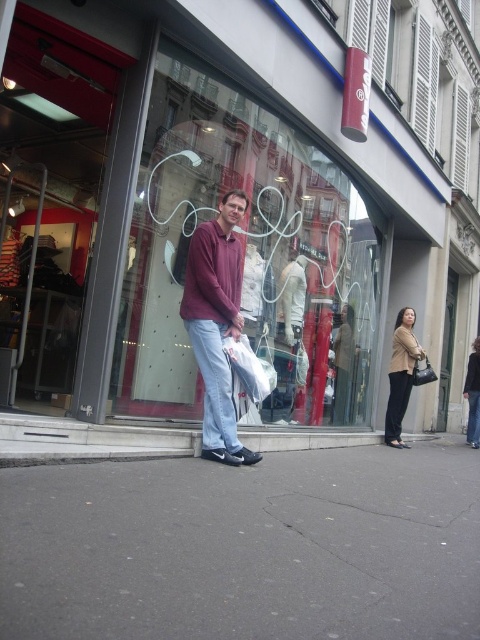
Looking at this image, you are a delivery person with a cart that is 6 feet long. You need to move your cart from the transparent glass shop window at center to the gray concrete curb at lower center. Is there enough space to move the cart straight without turning?

The distance between the transparent glass shop window at center and the gray concrete curb at lower center is 7.34 feet. Since the cart is 6 feet long, there is enough space to move it straight without turning.